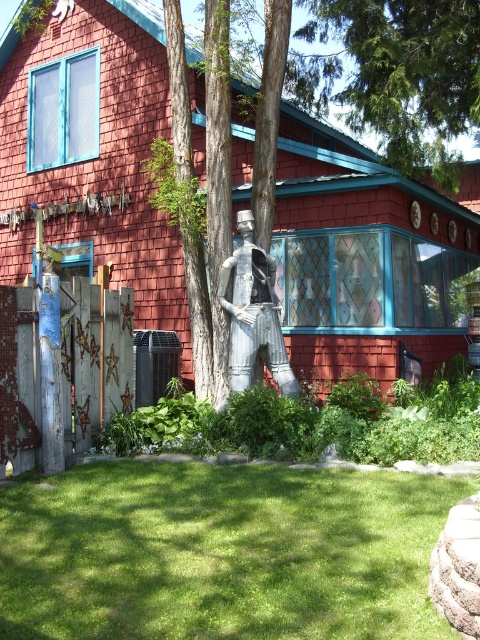
Is green leafy tree at upper center to the right of metallic statue at center from the viewer's perspective?

Correct, you'll find green leafy tree at upper center to the right of metallic statue at center.

Is green leafy tree at upper center taller than metallic statue at center?

Yes.

Locate an element on the screen. The height and width of the screenshot is (640, 480). green leafy tree at upper center is located at coordinates (406, 74).

This screenshot has height=640, width=480. Identify the location of green leafy tree at upper center. (406, 74).

Does smooth bark tree at center have a lesser width compared to green leafy tree at upper center?

Incorrect, smooth bark tree at center's width is not less than green leafy tree at upper center's.

Does point (6, 33) lie in front of point (384, 131)?

No, it is not.

Which is in front, point (238, 120) or point (307, 54)?

Positioned in front is point (238, 120).

The image size is (480, 640). What are the coordinates of `smooth bark tree at center` in the screenshot? It's located at (92, 145).

Can you confirm if smooth bark tree at center is positioned to the left of green grass at center?

Yes, smooth bark tree at center is to the left of green grass at center.

Locate an element on the screen. smooth bark tree at center is located at coordinates (92, 145).

Which is behind, point (360, 198) or point (50, 556)?

The point (360, 198) is more distant.

Locate an element on the screen. This screenshot has height=640, width=480. smooth bark tree at center is located at coordinates (92, 145).